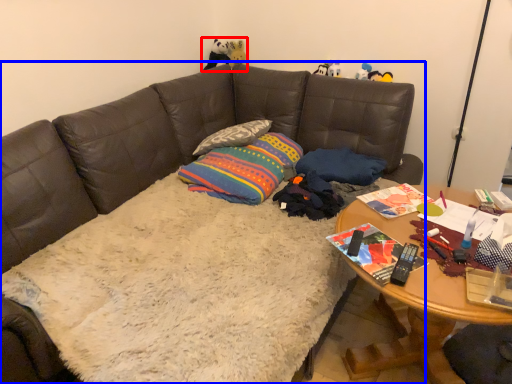
Question: Which point is further to the camera, toy (highlighted by a red box) or studio couch (highlighted by a blue box)?

Choices:
 (A) toy
 (B) studio couch

Answer: (A)